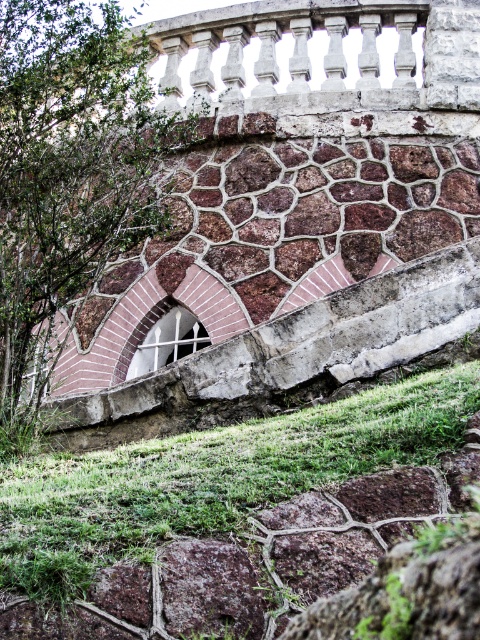
Does green leafy tree at upper left have a greater width compared to white glass window at center?

Yes, green leafy tree at upper left is wider than white glass window at center.

Is point (14, 320) farther from viewer compared to point (151, 328)?

No, (14, 320) is closer to viewer.

At what (x,y) coordinates should I click in order to perform the action: click on green leafy tree at upper left. Please return your answer as a coordinate pair (x, y). Looking at the image, I should click on (69, 177).

Between green leafy tree at upper left and green grass at lower center, which one appears on the left side from the viewer's perspective?

green leafy tree at upper left is more to the left.

Is green leafy tree at upper left shorter than green grass at lower center?

No.

The width and height of the screenshot is (480, 640). In order to click on green leafy tree at upper left in this screenshot , I will do `click(69, 177)`.

Is the position of green grass at lower center more distant than that of white glass window at center?

No, it is in front of white glass window at center.

Is green grass at lower center bigger than white glass window at center?

Yes, green grass at lower center is bigger than white glass window at center.

Which is behind, point (218, 481) or point (166, 317)?

The point (166, 317) is more distant.

Find the location of a particular element. green grass at lower center is located at coordinates (211, 477).